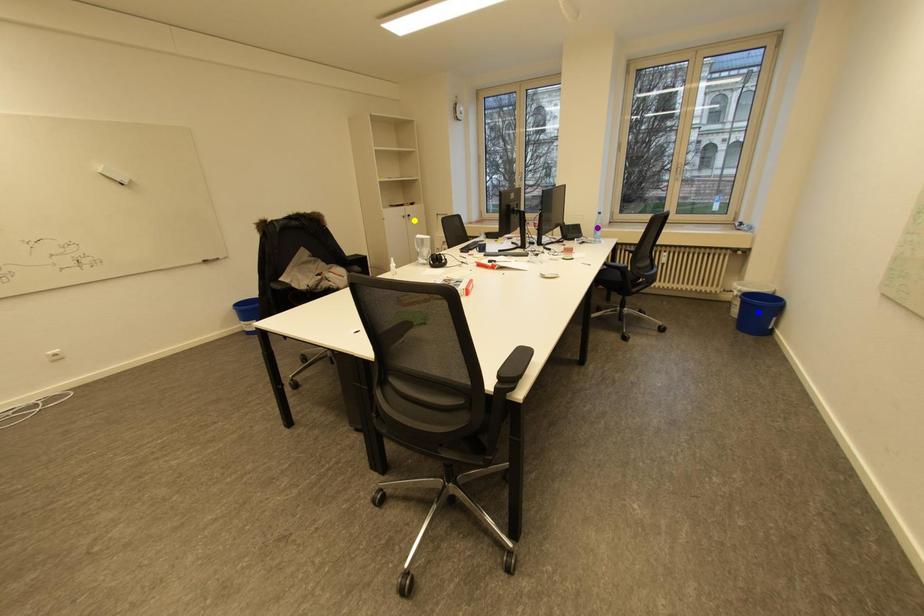
Order these from nearest to farthest:
A) yellow point
B) purple point
C) blue point

1. yellow point
2. blue point
3. purple point